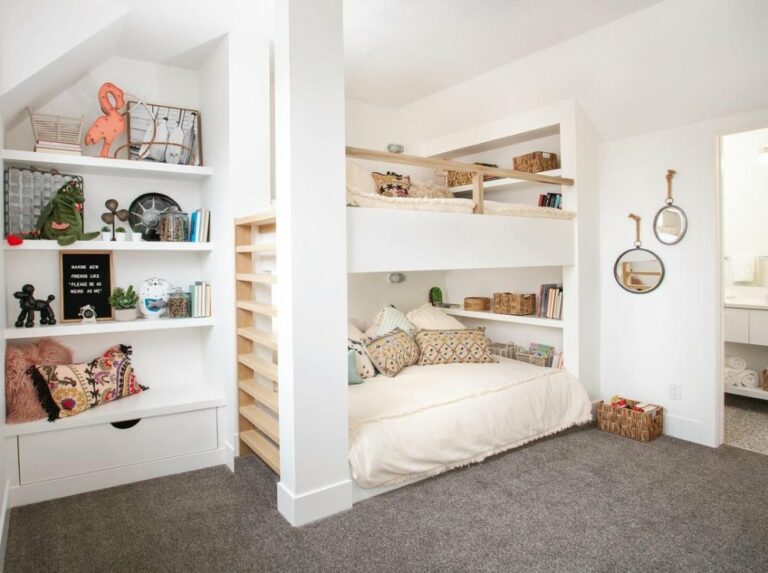
Locate an element on the screen. pillows on shelf is located at coordinates [15, 379], [81, 391].